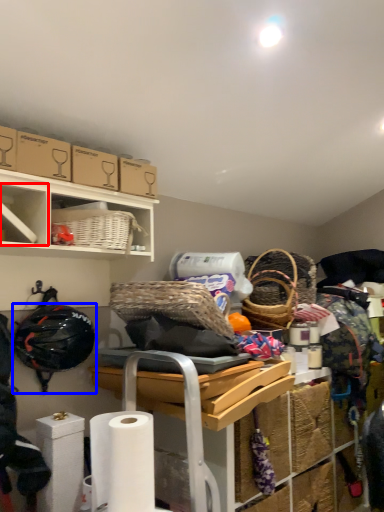
Question: Among these objects, which one is nearest to the camera, cabinet (highlighted by a red box) or helmet (highlighted by a blue box)?

Choices:
 (A) cabinet
 (B) helmet

Answer: (A)